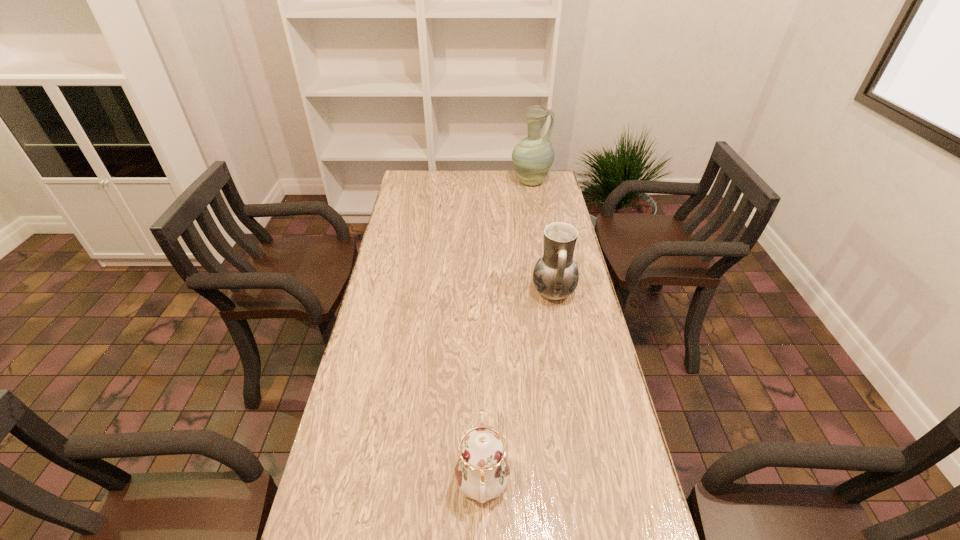
At what (x,y) coordinates should I click in order to perform the action: click on vacant space in between the nearer pitcher and the taller pitcher. Please return your answer as a coordinate pair (x, y). Looking at the image, I should click on tap(542, 237).

Locate an element on the screen. This screenshot has height=540, width=960. empty space between the tallest object and the shortest object is located at coordinates (507, 333).

At what (x,y) coordinates should I click in order to perform the action: click on object that can be found as the second closest to the nearest object. Please return your answer as a coordinate pair (x, y). Looking at the image, I should click on (533, 156).

Where is `object that can be found as the closest to the farthest object`? object that can be found as the closest to the farthest object is located at coordinates (555, 276).

Locate an element on the screen. This screenshot has width=960, height=540. free spot that satisfies the following two spatial constraints: 1. on the front-facing side of the second farthest object; 2. on the front side of the chinaware is located at coordinates (588, 483).